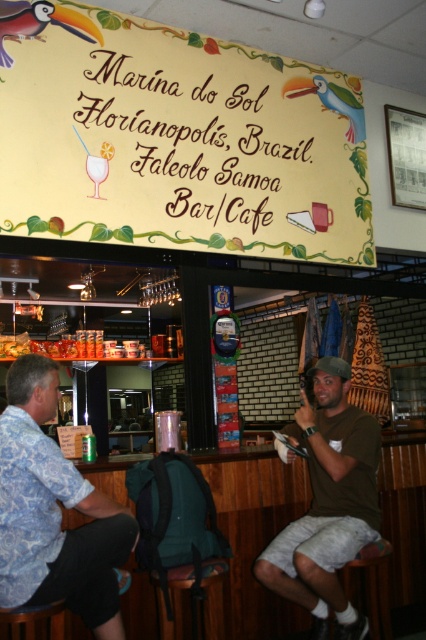
You are a customer at the Marina do Sol bar and want to order a drink. You see a blue floral shirt at left and a wooden bar stool at lower left. Which object is taller?

Answer: The blue floral shirt at left is much taller than the wooden bar stool at lower left.